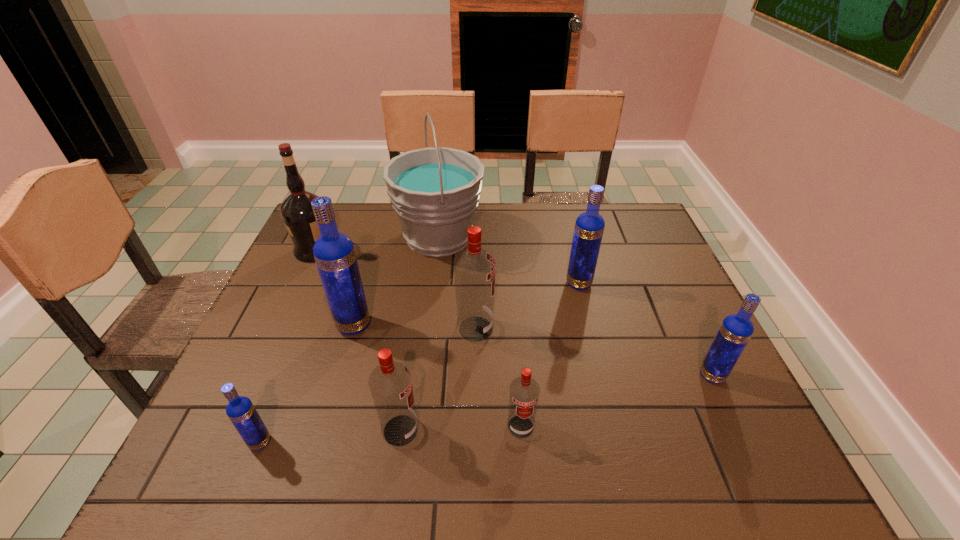
Locate an element on the screen. bucket is located at coordinates (435, 191).

Find the location of `the second vodka from left to right`. the second vodka from left to right is located at coordinates (334, 253).

At what (x,y) coordinates should I click in order to perform the action: click on the biggest blue vodka. Please return your answer as a coordinate pair (x, y). The height and width of the screenshot is (540, 960). Looking at the image, I should click on (334, 253).

I want to click on liquor, so click(x=296, y=210).

The height and width of the screenshot is (540, 960). I want to click on the third farthest object, so click(x=589, y=227).

The height and width of the screenshot is (540, 960). I want to click on the second blue vodka from right to left, so click(x=589, y=227).

The height and width of the screenshot is (540, 960). In order to click on the farthest red vodka in this screenshot , I will do `click(474, 268)`.

I want to click on the second red vodka from left to right, so click(x=474, y=268).

This screenshot has height=540, width=960. What are the coordinates of `the second smallest blue vodka` in the screenshot? It's located at (735, 331).

You are a GUI agent. You are given a task and a screenshot of the screen. Output one action in this format:
    pyautogui.click(x=<x>, y=<y>)
    Task: Click on the sixth farthest object
    The height and width of the screenshot is (540, 960).
    Given the screenshot: What is the action you would take?
    pyautogui.click(x=735, y=331)